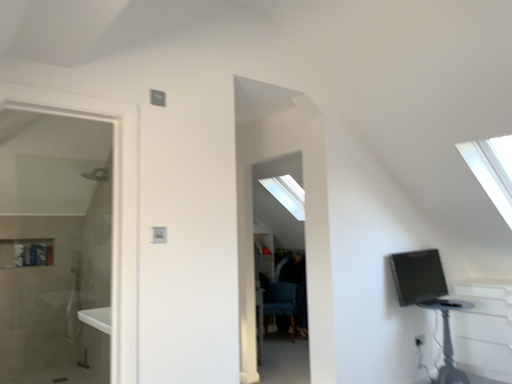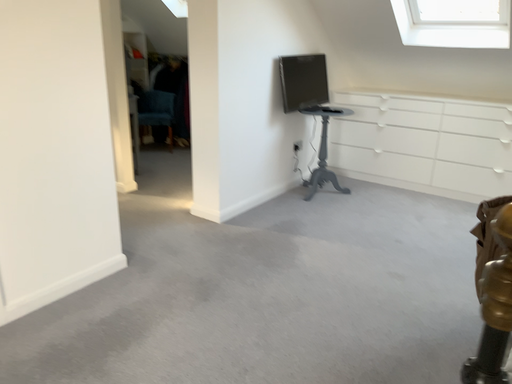
Question: How did the camera likely rotate when shooting the video?

Choices:
 (A) rotated right
 (B) rotated left

Answer: (A)